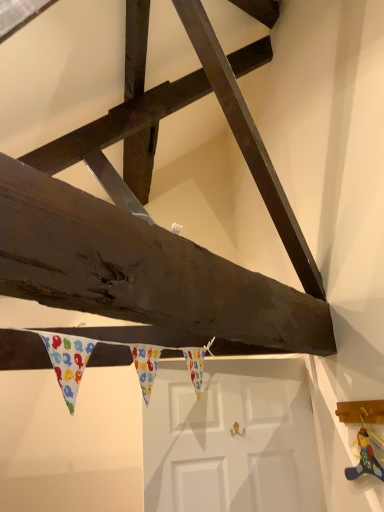
Question: Is wooden toy at lower right surrounded by white matte door at center?

Choices:
 (A) yes
 (B) no

Answer: (B)

Question: Is white matte door at center looking in the opposite direction of wooden toy at lower right?

Choices:
 (A) yes
 (B) no

Answer: (A)

Question: Does white matte door at center have a larger size compared to wooden toy at lower right?

Choices:
 (A) yes
 (B) no

Answer: (A)

Question: From a real-world perspective, is white matte door at center positioned under wooden toy at lower right based on gravity?

Choices:
 (A) yes
 (B) no

Answer: (A)

Question: Is white matte door at center further to camera compared to wooden toy at lower right?

Choices:
 (A) yes
 (B) no

Answer: (A)

Question: Is the surface of white matte door at center in direct contact with wooden toy at lower right?

Choices:
 (A) yes
 (B) no

Answer: (B)

Question: Considering the relative positions of wooden toy at lower right and white matte door at center in the image provided, is wooden toy at lower right to the right of white matte door at center from the viewer's perspective?

Choices:
 (A) yes
 (B) no

Answer: (A)

Question: Is wooden toy at lower right to the left of white matte door at center from the viewer's perspective?

Choices:
 (A) no
 (B) yes

Answer: (A)

Question: Is wooden toy at lower right thinner than white matte door at center?

Choices:
 (A) no
 (B) yes

Answer: (B)

Question: Considering the relative positions of wooden toy at lower right and white matte door at center in the image provided, is wooden toy at lower right behind white matte door at center?

Choices:
 (A) no
 (B) yes

Answer: (A)

Question: Could you tell me if wooden toy at lower right is facing white matte door at center?

Choices:
 (A) yes
 (B) no

Answer: (B)

Question: Is wooden toy at lower right completely or partially outside of white matte door at center?

Choices:
 (A) no
 (B) yes

Answer: (B)

Question: Is white matte door at center inside the boundaries of wooden toy at lower right, or outside?

Choices:
 (A) inside
 (B) outside

Answer: (B)